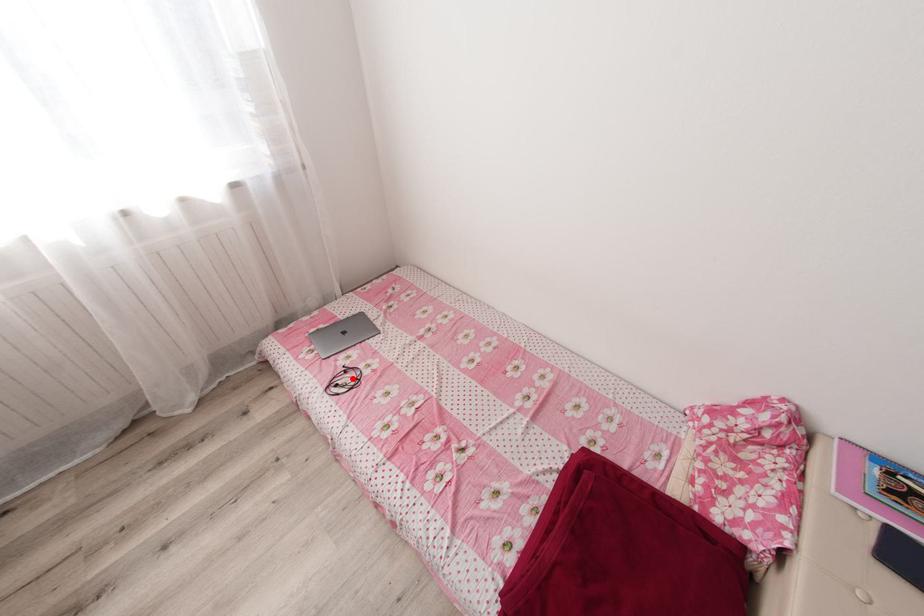
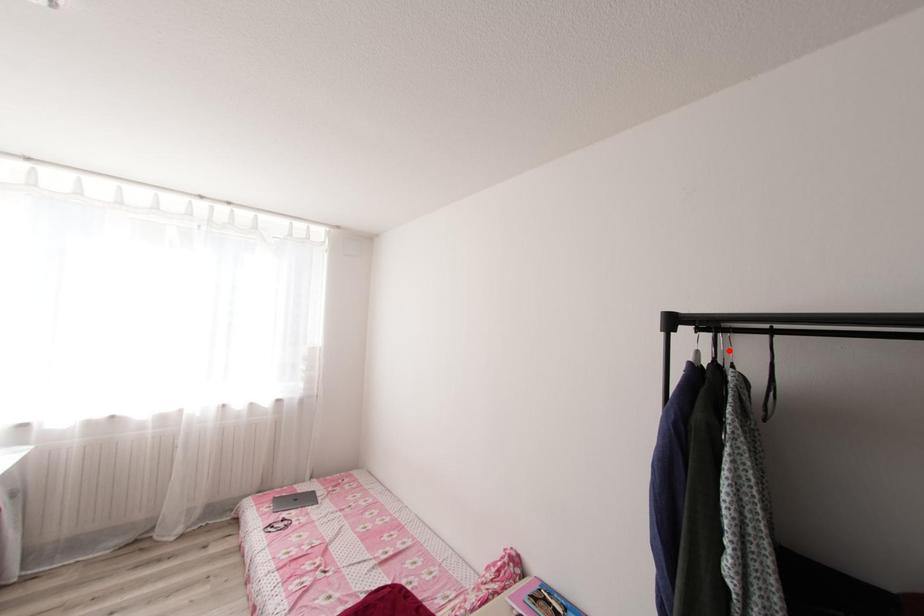
I am providing you with two images of the same scene from different viewpoints. A red point is marked on the first image and another point is marked on the second image. Is the marked point in image1 the same physical position as the marked point in image2?

No